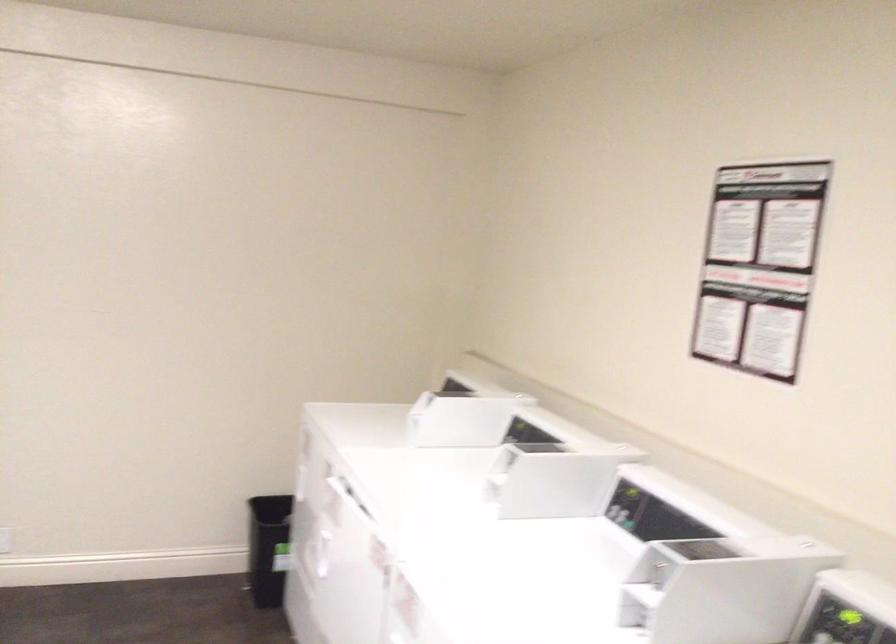
Image resolution: width=896 pixels, height=644 pixels. Describe the element at coordinates (348, 494) in the screenshot. I see `a dryer door handle` at that location.